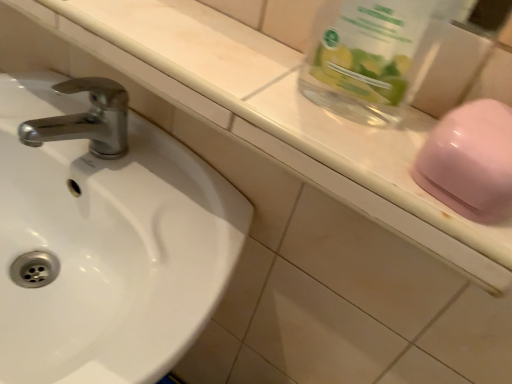
What do you see at coordinates (106, 247) in the screenshot? This screenshot has width=512, height=384. I see `white glossy sink at left` at bounding box center [106, 247].

Where is `white glossy sink at left`? The image size is (512, 384). white glossy sink at left is located at coordinates (106, 247).

This screenshot has height=384, width=512. I want to click on transparent glass jar at upper right, so click(373, 55).

Is glossy plastic soap at right located outside transparent glass jar at upper right?

That's correct, glossy plastic soap at right is outside of transparent glass jar at upper right.

Considering the relative positions of glossy plastic soap at right and transparent glass jar at upper right in the image provided, is glossy plastic soap at right behind transparent glass jar at upper right?

Yes, it is behind transparent glass jar at upper right.

Does point (492, 139) come in front of point (308, 65)?

Yes, point (492, 139) is closer to viewer.

Is glossy plastic soap at right shorter than transparent glass jar at upper right?

Correct, glossy plastic soap at right is not as tall as transparent glass jar at upper right.

Which object is wider, white glossy sink at left or transparent glass jar at upper right?

white glossy sink at left.

Locate an element on the screen. sink below the transparent glass jar at upper right (from a real-world perspective) is located at coordinates (106, 247).

What's the angular difference between white glossy sink at left and glossy plastic soap at right's facing directions?

They differ by 0.000861 degrees in their facing directions.

Considering the relative sizes of white glossy sink at left and glossy plastic soap at right in the image provided, is white glossy sink at left thinner than glossy plastic soap at right?

In fact, white glossy sink at left might be wider than glossy plastic soap at right.

Could you tell me if white glossy sink at left is facing glossy plastic soap at right?

No, white glossy sink at left does not turn towards glossy plastic soap at right.

Is white glossy sink at left outside of glossy plastic soap at right?

Absolutely, white glossy sink at left is external to glossy plastic soap at right.

From a real-world perspective, is transparent glass jar at upper right physically located above or below white glossy sink at left?

transparent glass jar at upper right is situated higher than white glossy sink at left in the real world.

Based on their positions, is transparent glass jar at upper right located to the left or right of white glossy sink at left?

From the image, it's evident that transparent glass jar at upper right is to the right of white glossy sink at left.

From the image's perspective, is transparent glass jar at upper right below white glossy sink at left?

Incorrect, from the image's perspective, transparent glass jar at upper right is higher than white glossy sink at left.

Is glossy plastic soap at right next to white glossy sink at left?

No, glossy plastic soap at right is not making contact with white glossy sink at left.

How distant is glossy plastic soap at right from white glossy sink at left?

The distance of glossy plastic soap at right from white glossy sink at left is 15.93 inches.

Looking at their sizes, would you say glossy plastic soap at right is wider or thinner than white glossy sink at left?

Clearly, glossy plastic soap at right has less width compared to white glossy sink at left.

Is white glossy sink at left completely or partially inside glossy plastic soap at right?

No, white glossy sink at left is not a part of glossy plastic soap at right.

Which object is thinner, transparent glass jar at upper right or glossy plastic soap at right?

Thinner between the two is transparent glass jar at upper right.

Considering the sizes of objects transparent glass jar at upper right and glossy plastic soap at right in the image provided, who is bigger, transparent glass jar at upper right or glossy plastic soap at right?

Bigger between the two is transparent glass jar at upper right.

You are a GUI agent. You are given a task and a screenshot of the screen. Output one action in this format:
    pyautogui.click(x=<x>, y=<y>)
    Task: Click on the glass jar located above the glossy plastic soap at right (from a real-world perspective)
    The image size is (512, 384).
    Given the screenshot: What is the action you would take?
    pyautogui.click(x=373, y=55)

Locate an element on the screen. The image size is (512, 384). glass jar above the white glossy sink at left (from the image's perspective) is located at coordinates (373, 55).

Estimate the real-world distances between objects in this image. Which object is closer to glossy plastic soap at right, transparent glass jar at upper right or white glossy sink at left?

Among the two, transparent glass jar at upper right is located nearer to glossy plastic soap at right.

Considering their positions, is white glossy sink at left positioned further to transparent glass jar at upper right than glossy plastic soap at right?

white glossy sink at left is positioned further to the anchor transparent glass jar at upper right.

Which object lies further to the anchor point glossy plastic soap at right, white glossy sink at left or transparent glass jar at upper right?

Among the two, white glossy sink at left is located further to glossy plastic soap at right.

When comparing their distances from white glossy sink at left, does glossy plastic soap at right or transparent glass jar at upper right seem further?

glossy plastic soap at right is positioned further to the anchor white glossy sink at left.

From the image, which object appears to be nearer to white glossy sink at left, transparent glass jar at upper right or glossy plastic soap at right?

Among the two, transparent glass jar at upper right is located nearer to white glossy sink at left.

From the image, which object appears to be nearer to transparent glass jar at upper right, glossy plastic soap at right or white glossy sink at left?

The object closer to transparent glass jar at upper right is glossy plastic soap at right.

This screenshot has height=384, width=512. I want to click on glass jar situated between white glossy sink at left and glossy plastic soap at right from left to right, so click(373, 55).